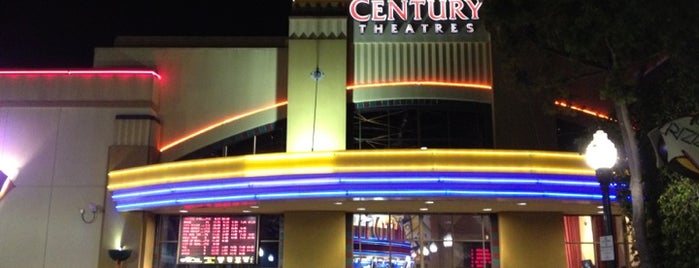
Image resolution: width=699 pixels, height=268 pixels. Find the location of `blue neon light`. blue neon light is located at coordinates (330, 192).